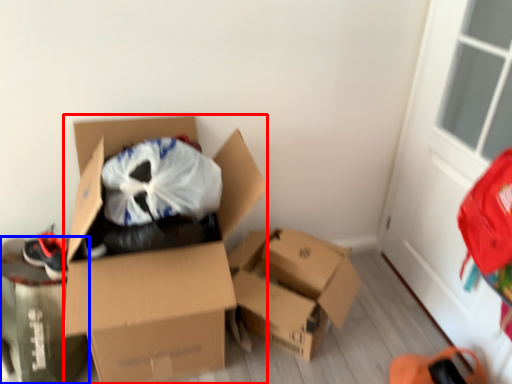
Question: Which point is closer to the camera, box (highlighted by a red box) or cardboard box (highlighted by a blue box)?

Choices:
 (A) box
 (B) cardboard box

Answer: (A)